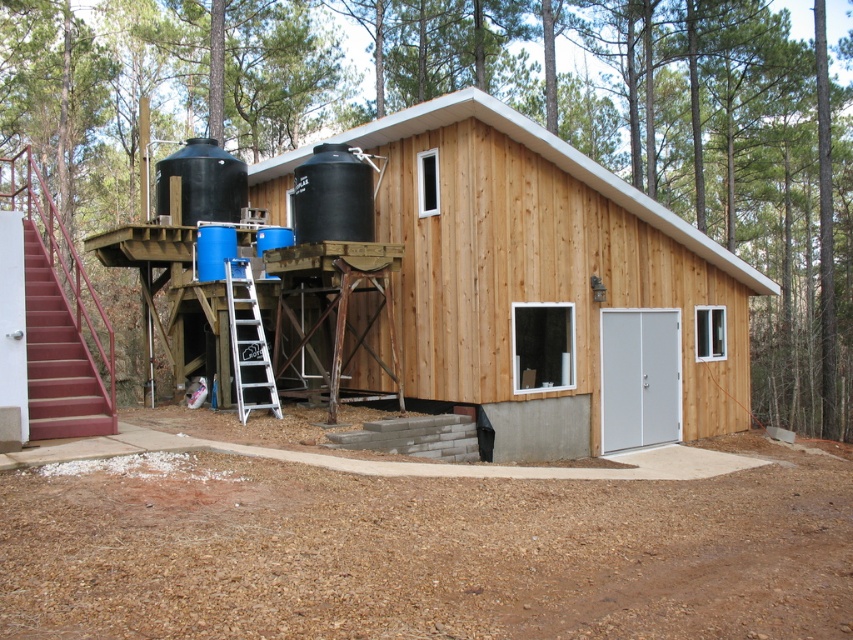
Question: Does black matte water tank at upper center have a smaller size compared to white aluminum ladder at center?

Choices:
 (A) yes
 (B) no

Answer: (A)

Question: Which point is farther from the camera taking this photo?

Choices:
 (A) (233, 369)
 (B) (338, 182)
 (C) (695, 380)

Answer: (C)

Question: Is natural wood cabin at center above black matte water tank at upper left?

Choices:
 (A) no
 (B) yes

Answer: (A)

Question: Which object appears farthest from the camera in this image?

Choices:
 (A) natural wood cabin at center
 (B) white aluminum ladder at center
 (C) black matte water tank at upper center

Answer: (A)

Question: Is the position of natural wood cabin at center less distant than that of black matte water tank at upper center?

Choices:
 (A) yes
 (B) no

Answer: (B)

Question: Which object is the farthest from the natural wood cabin at center?

Choices:
 (A) white aluminum ladder at center
 (B) black matte water tank at upper center

Answer: (B)